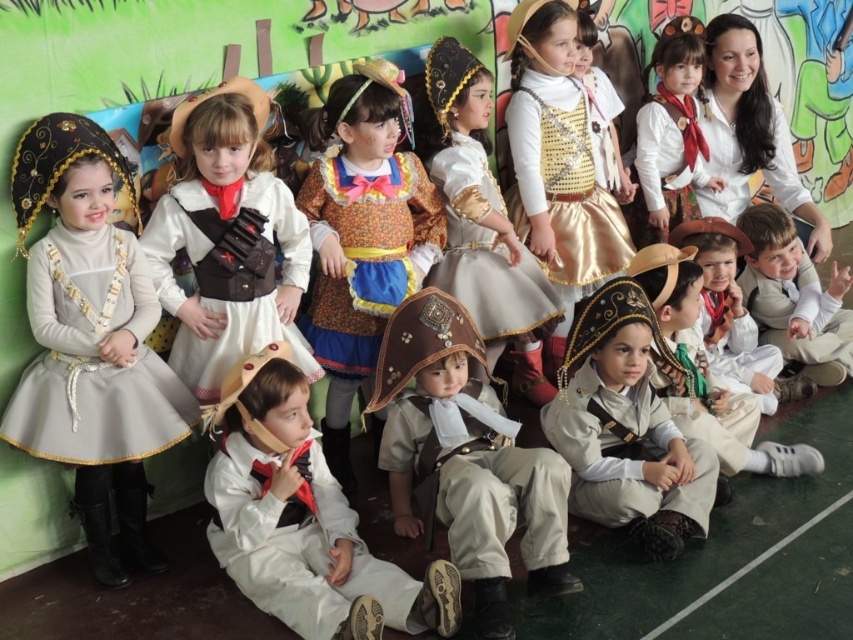
Which of these two, light beige fabric vest at center or light beige fabric hat at lower center, stands taller?

light beige fabric hat at lower center

How much distance is there between light beige fabric vest at center and light beige fabric hat at lower center?

light beige fabric vest at center and light beige fabric hat at lower center are 14.75 inches apart from each other.

Between point (646, 449) and point (782, 465), which one is positioned in front?

Point (646, 449) is more forward.

What are the coordinates of `light beige fabric vest at center` in the screenshot? It's located at (624, 451).

Between white satin pirate costume at center and matte white dress at upper right, which one has less height?

With less height is white satin pirate costume at center.

In order to click on white satin pirate costume at center in this screenshot , I will do `click(303, 518)`.

At what (x,y) coordinates should I click in order to perform the action: click on white satin pirate costume at center. Please return your answer as a coordinate pair (x, y). Looking at the image, I should click on (303, 518).

Is point (447, 362) closer to camera compared to point (500, 268)?

That is True.

Describe the element at coordinates (466, 460) in the screenshot. I see `brown leather hat at center` at that location.

Find the location of a particular element. This screenshot has height=640, width=853. brown leather hat at center is located at coordinates (466, 460).